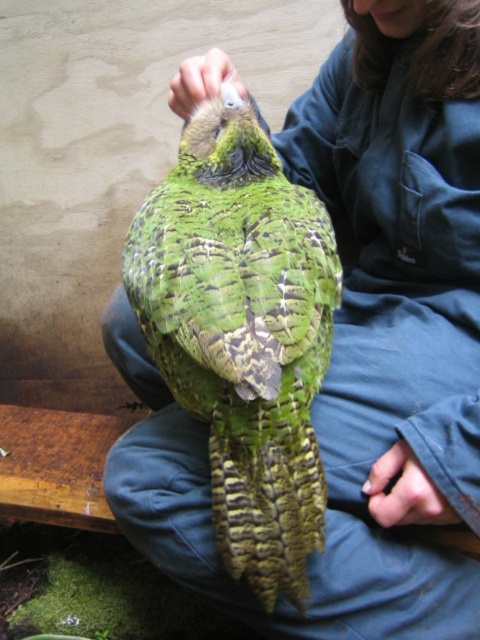
Who is more distant from viewer, (238, 472) or (447, 506)?

Positioned behind is point (447, 506).

Which of these two, green scaly parrot at center or smooth skin hand at lower right, stands taller?

With more height is green scaly parrot at center.

Between point (224, 516) and point (372, 484), which one is positioned behind?

The point (372, 484) is behind.

Locate an element on the screen. green scaly parrot at center is located at coordinates (242, 333).

Does green scaly parrot at center appear over white matte hand at upper center?

No.

Where is `green scaly parrot at center`? This screenshot has width=480, height=640. green scaly parrot at center is located at coordinates (242, 333).

Is point (436, 516) positioned in front of point (177, 77)?

Yes, it is in front of point (177, 77).

Can you confirm if smooth skin hand at lower right is bigger than white matte hand at upper center?

No, smooth skin hand at lower right is not bigger than white matte hand at upper center.

Does point (395, 476) come closer to viewer compared to point (179, 83)?

Yes.

Where is `smooth skin hand at lower right`? The width and height of the screenshot is (480, 640). smooth skin hand at lower right is located at coordinates (405, 492).